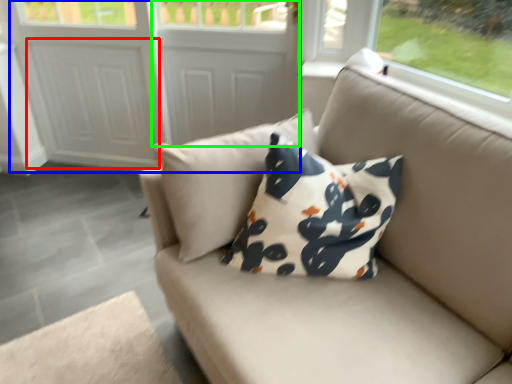
Question: Which object is the farthest from screen door (highlighted by a red box)? Choose among these: screen door (highlighted by a blue box) or screen door (highlighted by a green box).

Choices:
 (A) screen door
 (B) screen door

Answer: (B)